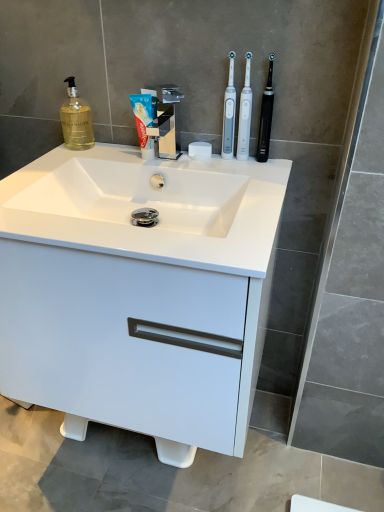
At what (x,y) coordinates should I click in order to perform the action: click on vacant area that is situated to the right of polished chrome faucet at center. Please return your answer as a coordinate pair (x, y). This screenshot has height=512, width=384. Looking at the image, I should click on click(224, 172).